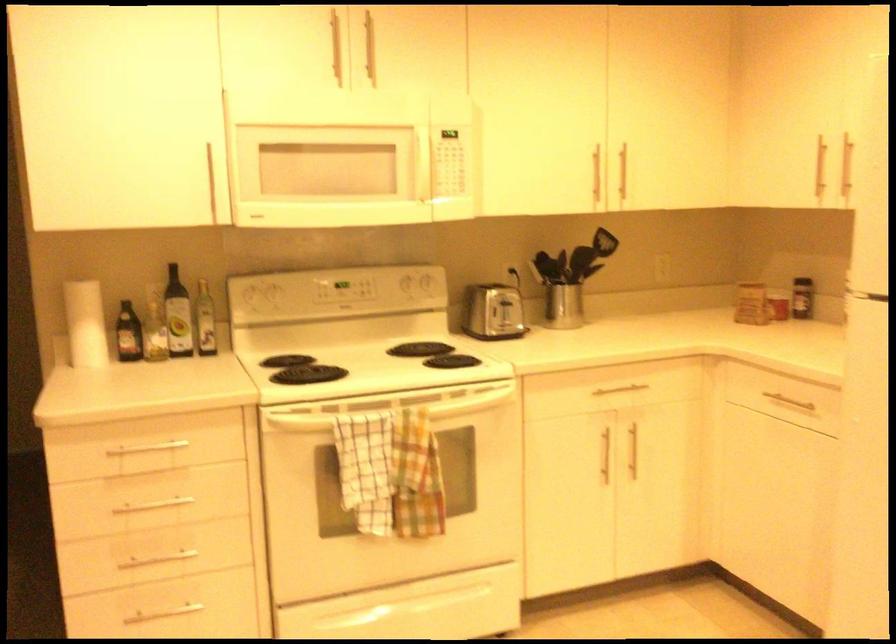
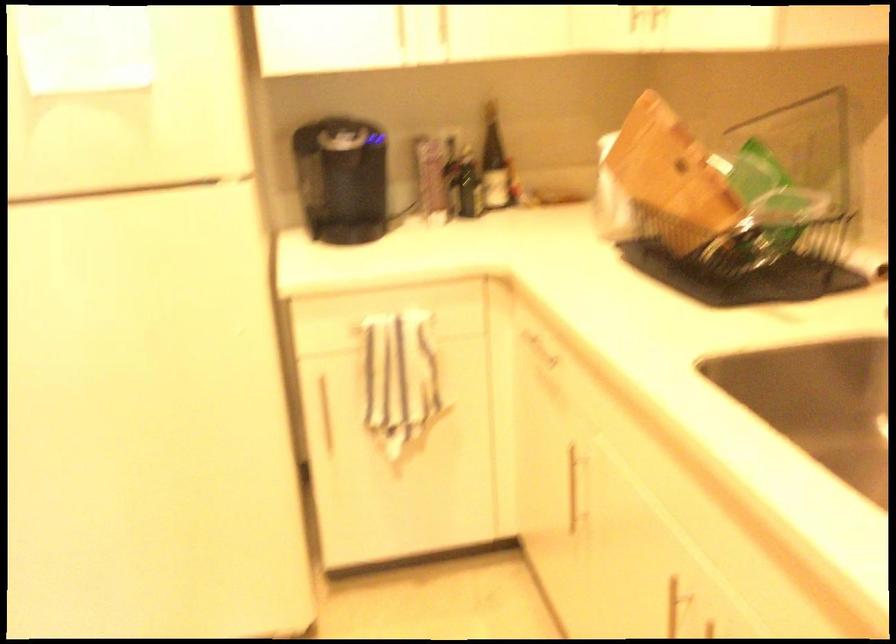
Based on the continuous images, in which direction is the camera rotating?

The rotation direction of the camera is right-down.